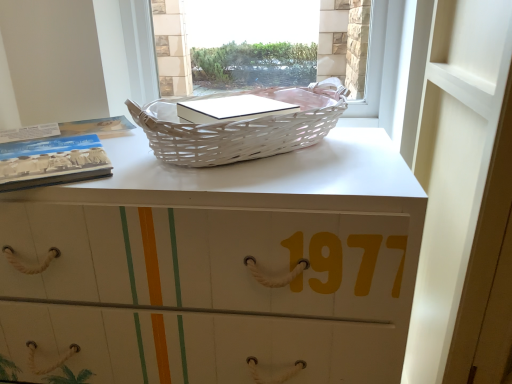
Locate an element on the screen. The width and height of the screenshot is (512, 384). vacant area that lies between matte paper book at left and white wicker picnic basket at upper center is located at coordinates (148, 160).